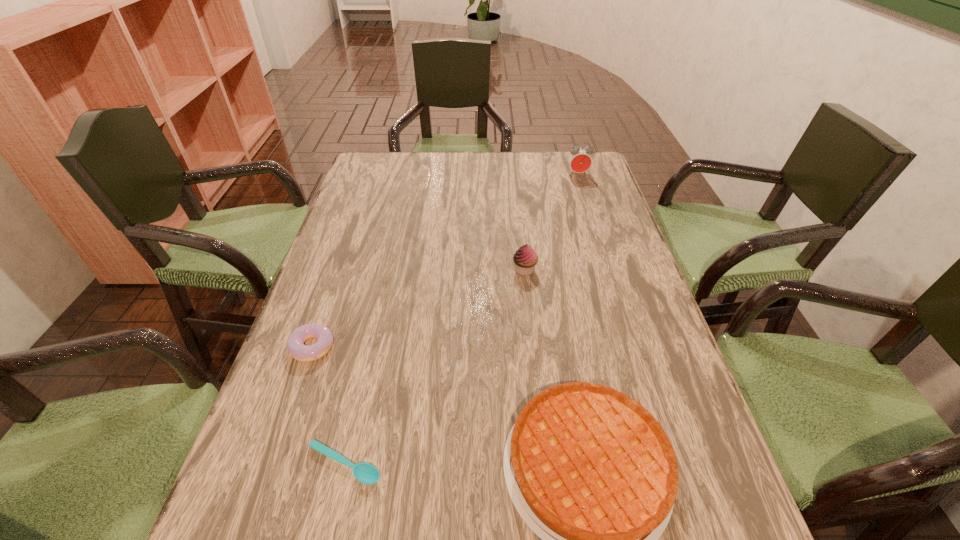
Find the location of a particular element. The width and height of the screenshot is (960, 540). vacant area that lies between the third farthest object and the fourth shortest object is located at coordinates (419, 308).

Locate an element on the screen. Image resolution: width=960 pixels, height=540 pixels. free spot between the fourth shortest object and the shortest object is located at coordinates (435, 367).

At what (x,y) coordinates should I click in order to perform the action: click on free space between the second object from left to right and the doughnut. Please return your answer as a coordinate pair (x, y). Looking at the image, I should click on (328, 406).

At what (x,y) coordinates should I click in order to perform the action: click on vacant point located between the cupcake and the fourth object from right to left. Please return your answer as a coordinate pair (x, y). Looking at the image, I should click on (435, 367).

The width and height of the screenshot is (960, 540). I want to click on unoccupied position between the shortest object and the alarm clock, so click(x=461, y=319).

Image resolution: width=960 pixels, height=540 pixels. What are the coordinates of `free spot between the farthest object and the doughnut` in the screenshot? It's located at 445,261.

I want to click on object that is the third closest to the third tallest object, so click(295, 344).

Identify which object is the fourth closest to the fourth nearest object. Please provide its 2D coordinates. Your answer should be formatted as a tuple, i.e. [(x, y)], where the tuple contains the x and y coordinates of a point satisfying the conditions above.

[(365, 473)]

Locate an element on the screen. This screenshot has height=540, width=960. free space that satisfies the following two spatial constraints: 1. on the back side of the shortest object; 2. on the left side of the second farthest object is located at coordinates (388, 270).